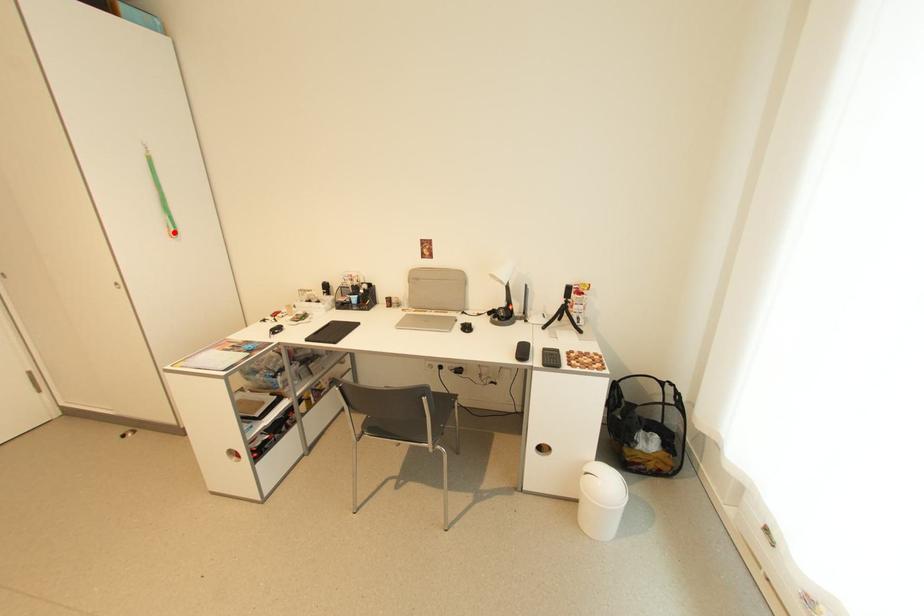
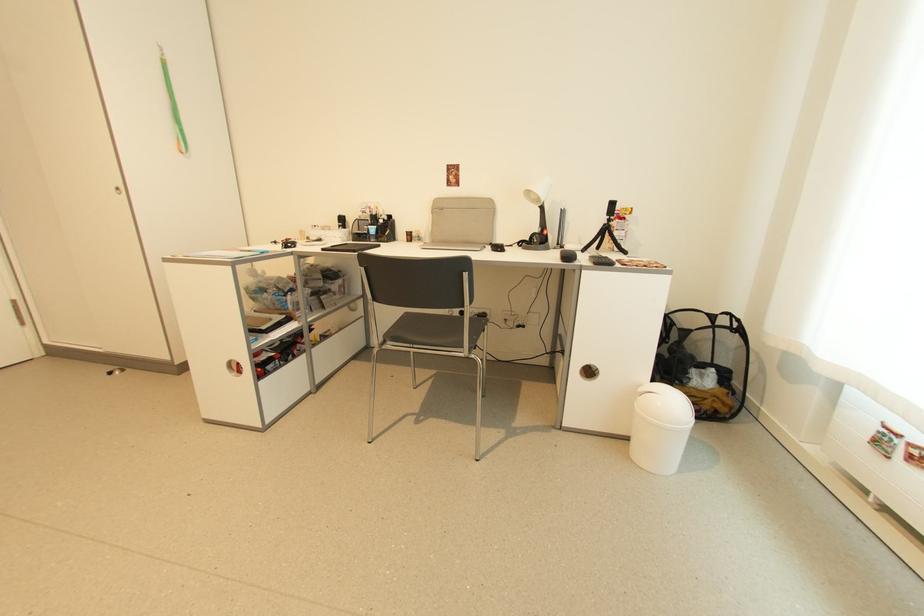
Locate, in the second image, the point that corresponds to the highlighted location in the first image.

(185, 146)